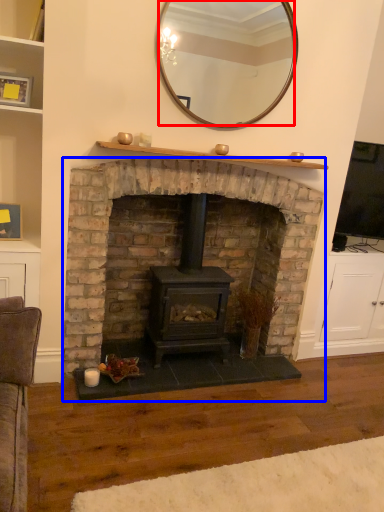
Question: Which object appears closest to the camera in this image, mirror (highlighted by a red box) or fireplace (highlighted by a blue box)?

Choices:
 (A) mirror
 (B) fireplace

Answer: (B)